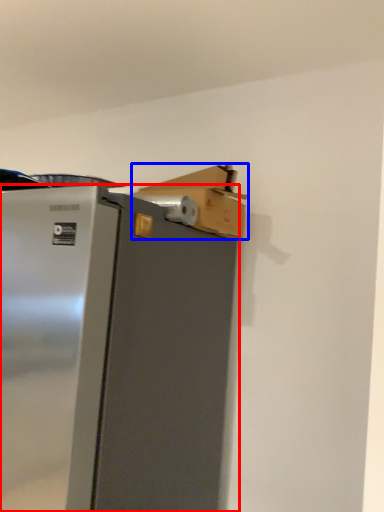
Question: Which point is closer to the camera, refrigerator (highlighted by a red box) or cardboard box (highlighted by a blue box)?

Choices:
 (A) refrigerator
 (B) cardboard box

Answer: (A)